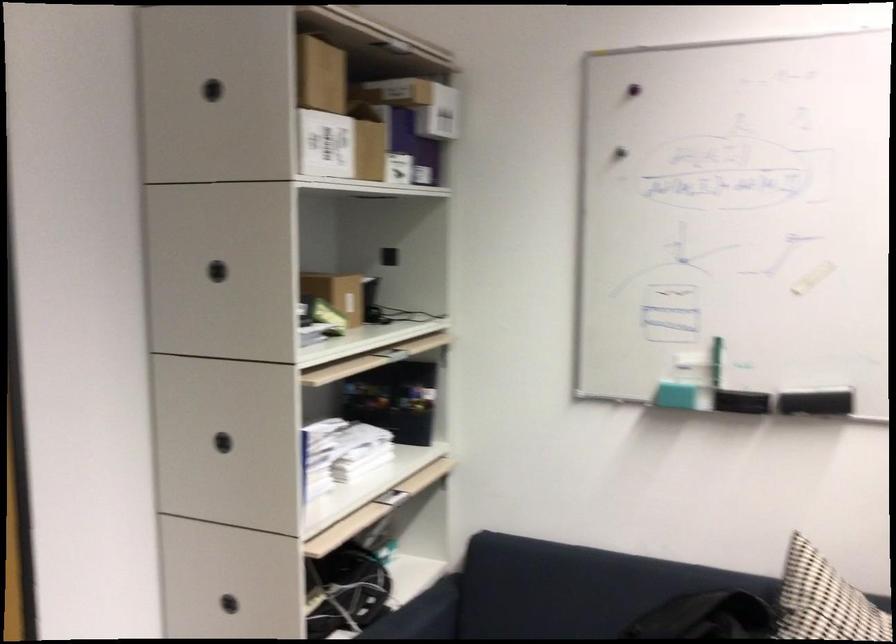
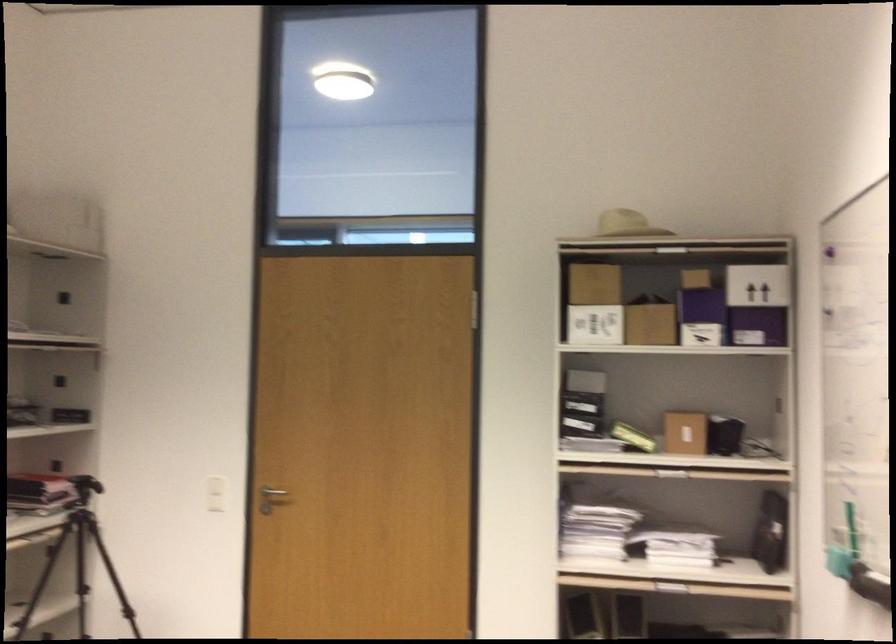
Question: I am providing you with two images of the same scene from different viewpoints. Which of the following objects are not visible in image2?

Choices:
 (A) green board eraser
 (B) white box with arrows
 (C) purple box
 (D) none of these

Answer: (D)